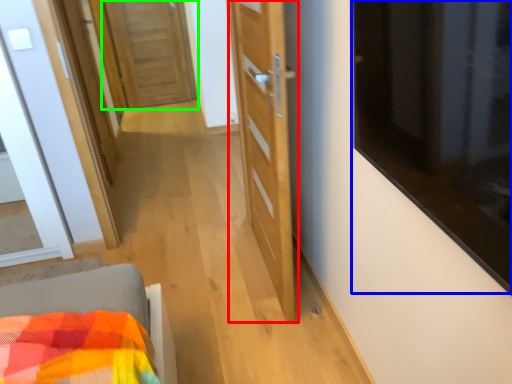
Question: Which object is the closest to the door (highlighted by a red box)? Choose among these: window (highlighted by a blue box) or door (highlighted by a green box).

Choices:
 (A) window
 (B) door

Answer: (A)